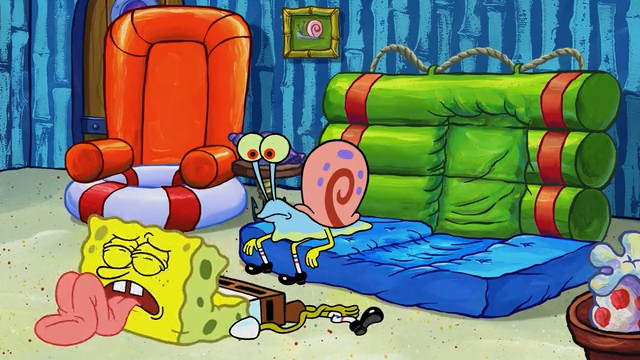
You are a GUI agent. You are given a task and a screenshot of the screen. Output one action in this format:
    pyautogui.click(x=<x>, y=<y>)
    Task: Click on the table
    This screenshot has width=640, height=360.
    Given the screenshot: What is the action you would take?
    pyautogui.click(x=573, y=313)